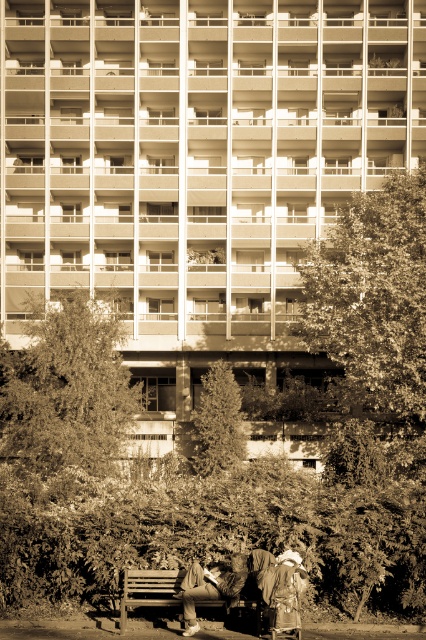
Is green leafy tree at center taller than leather jacket at lower center?

Yes.

Between point (58, 353) and point (293, 561), which one is positioned behind?

Positioned behind is point (58, 353).

Image resolution: width=426 pixels, height=640 pixels. Identify the location of green leafy tree at center. (66, 388).

Can you confirm if green leafy tree at center is shorter than matte black jacket at lower center?

No.

Looking at this image, is green leafy tree at center above matte black jacket at lower center?

Yes, green leafy tree at center is above matte black jacket at lower center.

Locate an element on the screen. The width and height of the screenshot is (426, 640). green leafy tree at center is located at coordinates (66, 388).

Who is higher up, green leafy tree at right or wooden bench at lower center?

Positioned higher is green leafy tree at right.

Can you confirm if green leafy tree at right is thinner than wooden bench at lower center?

In fact, green leafy tree at right might be wider than wooden bench at lower center.

Who is more forward, (345, 364) or (121, 598)?

Positioned in front is point (121, 598).

This screenshot has height=640, width=426. I want to click on green leafy tree at right, so click(373, 301).